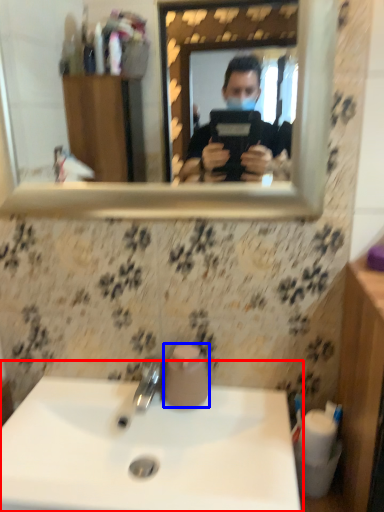
Question: Among these objects, which one is farthest to the camera, sink (highlighted by a red box) or toilet paper (highlighted by a blue box)?

Choices:
 (A) sink
 (B) toilet paper

Answer: (B)